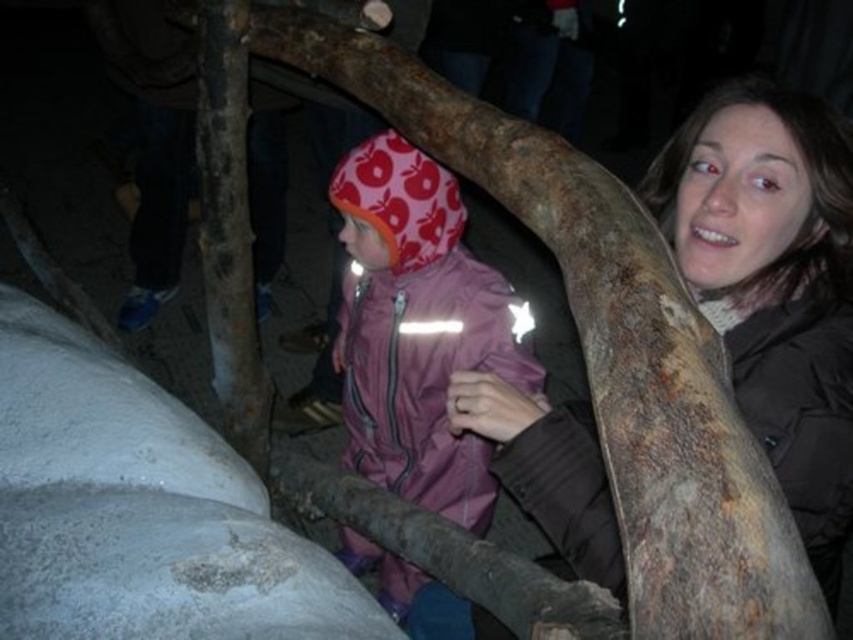
In the nighttime scene with the tree structure, where is the pink fabric jacket at center located in terms of its 2D coordinates?

The pink fabric jacket at center is located at the 2D coordinates point (x=416, y=330).

You are a photographer trying to capture a photo of the pink fabric jacket at center and the rusty wood tree trunk at center. If you want to ensure both objects are fully visible in the frame, which object requires more horizontal space in the camera viewfinder?

The pink fabric jacket at center requires more horizontal space in the camera viewfinder because its width surpasses that of the rusty wood tree trunk at center.